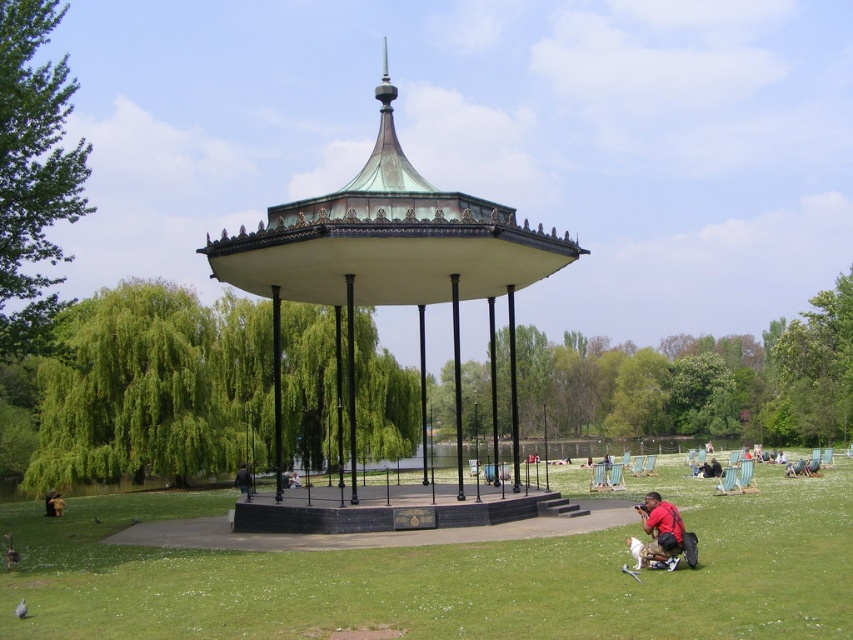
Can you confirm if bronze/golden gazebo at center is positioned to the right of green leafy tree at right?

In fact, bronze/golden gazebo at center is to the left of green leafy tree at right.

Does point (567, 508) lie behind point (786, 422)?

No, it is in front of (786, 422).

What are the coordinates of `bronze/golden gazebo at center` in the screenshot? It's located at tap(390, 260).

Is point (288, 449) farther from camera compared to point (785, 365)?

No, (288, 449) is closer to viewer.

Does green leafy tree at center appear under green leafy tree at right?

Yes, green leafy tree at center is below green leafy tree at right.

In order to click on green leafy tree at center in this screenshot , I will do `click(154, 388)`.

Can you confirm if green grassy at center is positioned above green leafy tree at center?

Actually, green grassy at center is below green leafy tree at center.

Measure the distance between point (792, 579) and camera.

Point (792, 579) is 16.30 meters away from camera.

Which is in front, point (584, 608) or point (393, 378)?

Point (584, 608)

The height and width of the screenshot is (640, 853). In order to click on green grassy at center in this screenshot , I will do `click(445, 577)`.